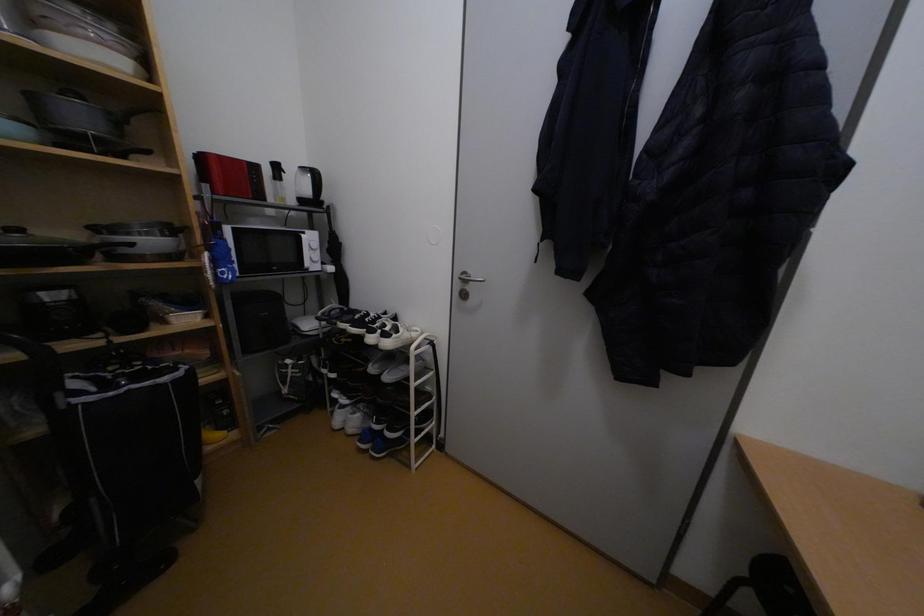
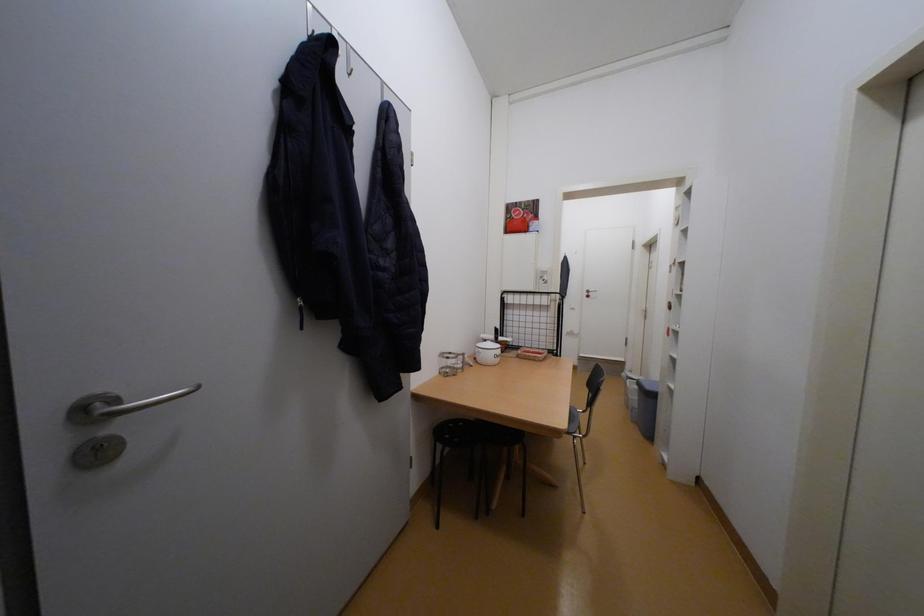
Question: The camera is either moving clockwise (left) or counter-clockwise (right) around the object. The first image is from the beginning of the video and the second image is from the end. Is the camera moving left or right when shooting the video?

Choices:
 (A) Left
 (B) Right

Answer: (A)